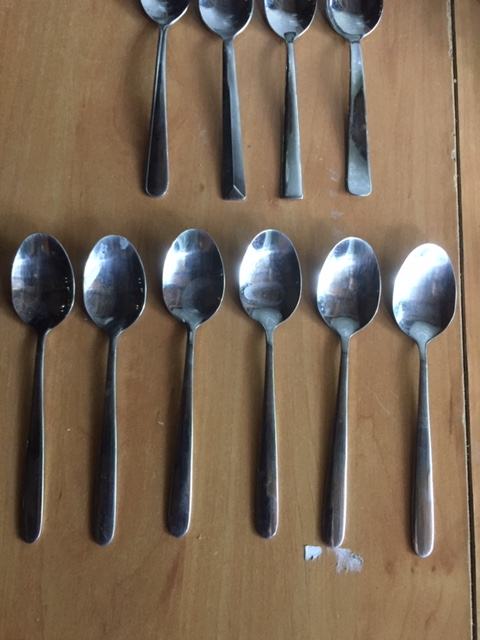
This screenshot has width=480, height=640. Identify the location of spoon bowl. (52, 285), (116, 287), (197, 285), (276, 287), (352, 305), (425, 308), (353, 13), (293, 13), (228, 12), (171, 6).